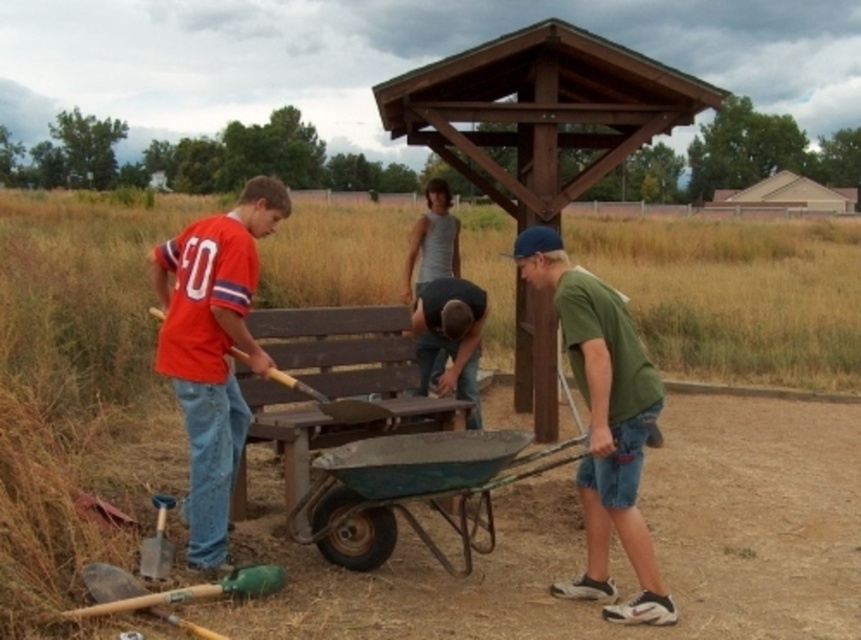
You are standing at the edge of the field and see the green matte shirt at lower right and the gray tank top at center. Which person is positioned more to the east?

The green matte shirt at lower right is positioned more to the east because it is to the right of the gray tank top at center, and in the scene, right typically corresponds to east.

You are a worker standing near the green metal wheelbarrow at center and the dark blue fabric shirt at center. You need to move the wheelbarrow to the right side of the shirt. Is the wheelbarrow currently on the correct side of the shirt?

The green metal wheelbarrow at center is positioned on the left side of dark blue fabric shirt at center, so it is not currently on the right side of the shirt. You need to move it to the right side.

You are standing at the edge of the grassy field, near the wooden structure. You need to reach the green matte shirt at lower right to hand them a tool. Considering the distance, can you comfortably walk to them without needing to run?

The distance between you and the green matte shirt at lower right is 14.52 feet. A distance of 14.52 feet is approximately 4.4 meters, which is a short walk. You can comfortably walk to them without needing to run.